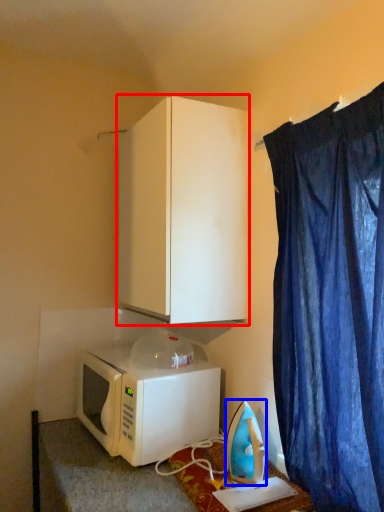
Question: Which object appears farthest to the camera in this image, cabinetry (highlighted by a red box) or appliance (highlighted by a blue box)?

Choices:
 (A) cabinetry
 (B) appliance

Answer: (A)